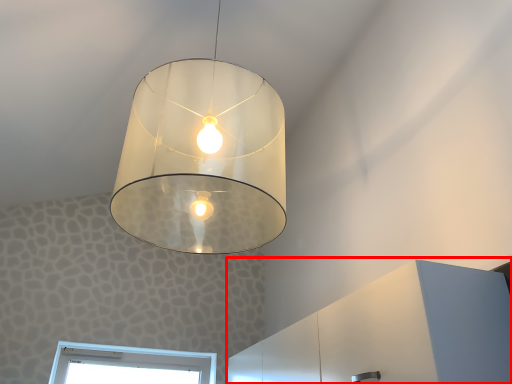
Question: In this image, where is dresser (annotated by the red box) located relative to lamp?

Choices:
 (A) left
 (B) right

Answer: (B)